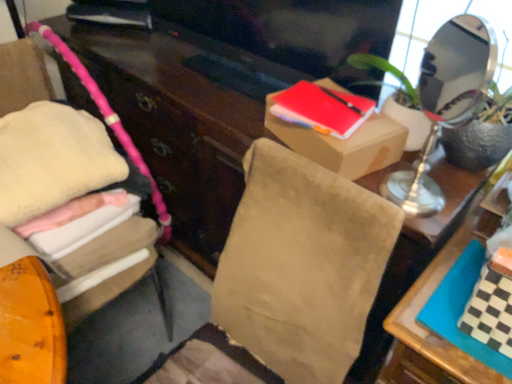
Image resolution: width=512 pixels, height=384 pixels. Find the location of `free spot to the left of matte cardboard box at upper right`. free spot to the left of matte cardboard box at upper right is located at coordinates (234, 112).